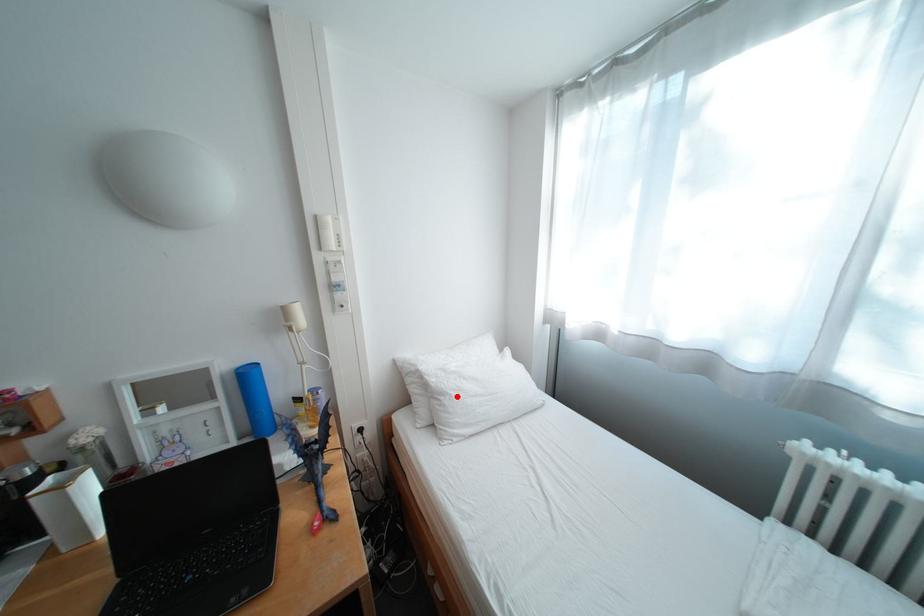
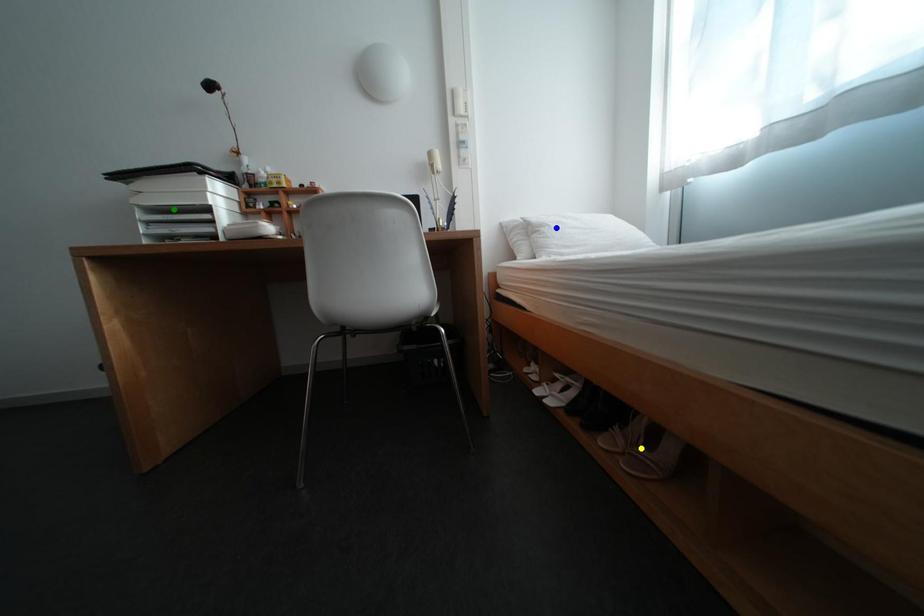
Question: I am providing you with two images of the same scene from different viewpoints. A red point is marked on the first image. You are given multiple points on the second image. Can you choose the point in image 2 that corresponds to the point in image 1?

Choices:
 (A) blue point
 (B) green point
 (C) yellow point

Answer: (A)